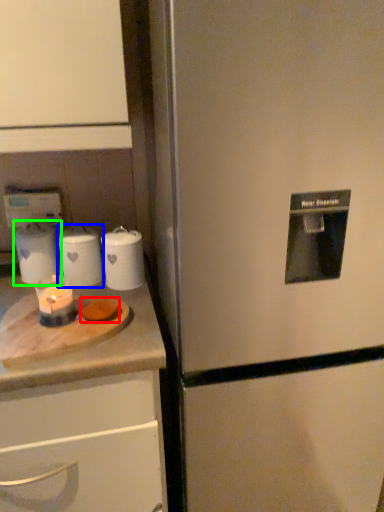
Question: Considering the real-world distances, which object is farthest from food (highlighted by a red box)? kitchen appliance (highlighted by a blue box) or appliance (highlighted by a green box)?

Choices:
 (A) kitchen appliance
 (B) appliance

Answer: (B)